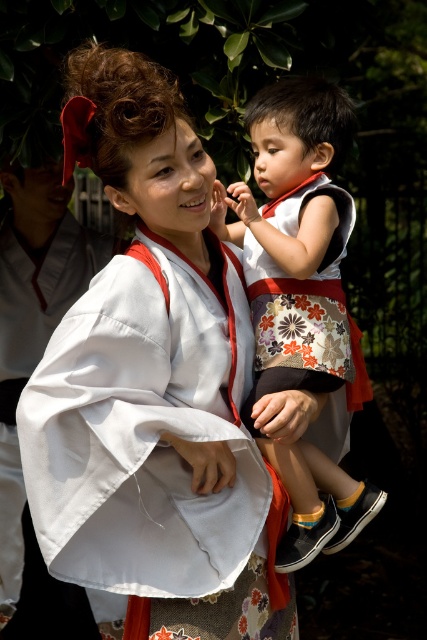
You are a photographer trying to capture a closeup of the child in the image. You have two points marked in the scene to focus on. The first point is at point (122,365) and the second point is at point (58,268). Which point should you choose to ensure the child is in focus?

Point (122,365) is closer to the viewer than point (58,268), so choosing point (122,365) will ensure the child is in focus.

In the scene, there are two people wearing kimonos at the center. The adult is wearing a white silk kimono at center, and the child is wearing a white cotton kimono at center. Which kimono is wider?

The white silk kimono at center is wider than the white cotton kimono at center.